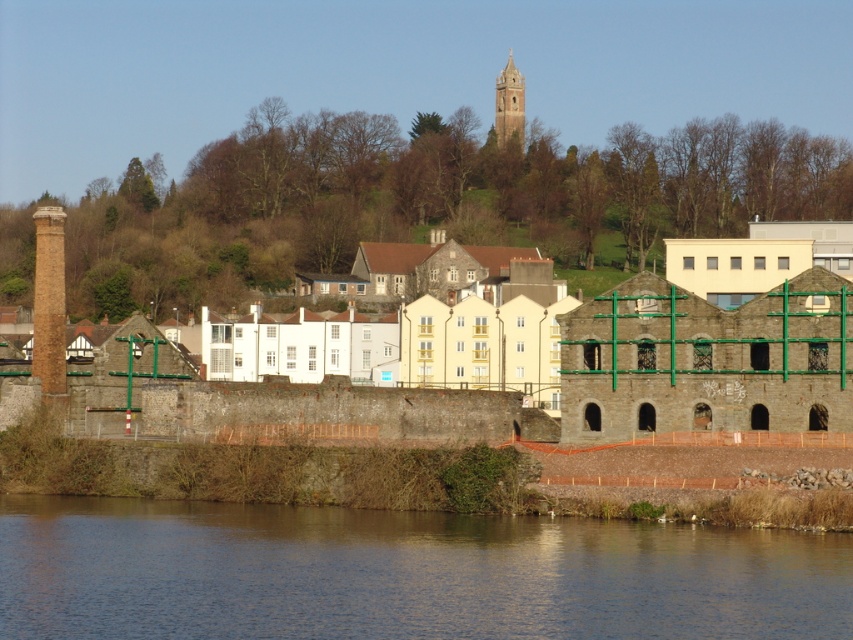
Question: Which object is farther from the camera taking this photo?

Choices:
 (A) rustic stone building at center
 (B) brown stone tower at upper center
 (C) brown water at lower left

Answer: (B)

Question: Which of the following is the closest to the observer?

Choices:
 (A) rustic stone building at center
 (B) brown stone tower at upper center

Answer: (A)

Question: Observing the image, what is the correct spatial positioning of brown water at lower left in reference to brown stone tower at upper center?

Choices:
 (A) right
 (B) left

Answer: (B)

Question: Can you confirm if rustic stone building at center is positioned below brown stone tower at upper center?

Choices:
 (A) no
 (B) yes

Answer: (B)

Question: Among these objects, which one is nearest to the camera?

Choices:
 (A) brown stone tower at upper center
 (B) brown water at lower left

Answer: (B)

Question: Is brown water at lower left to the right of brown stone tower at upper center from the viewer's perspective?

Choices:
 (A) yes
 (B) no

Answer: (B)